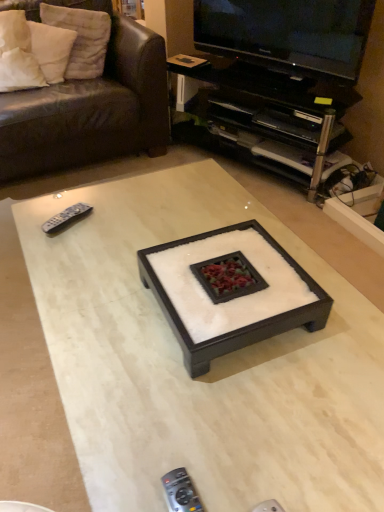
Image resolution: width=384 pixels, height=512 pixels. Identify the location of spots to the right of gray plastic remote at left, marked as the first remote control in a top-to-bottom arrangement. (118, 225).